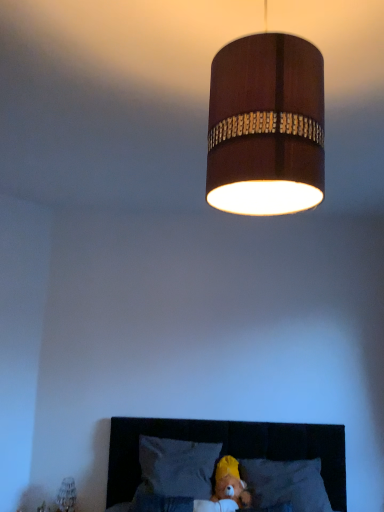
Question: Is velvet dark brown headboard at lower center aimed at wooden lampshade at upper center?

Choices:
 (A) no
 (B) yes

Answer: (A)

Question: Considering the relative sizes of velvet dark brown headboard at lower center and wooden lampshade at upper center in the image provided, is velvet dark brown headboard at lower center wider than wooden lampshade at upper center?

Choices:
 (A) yes
 (B) no

Answer: (A)

Question: Does velvet dark brown headboard at lower center contain wooden lampshade at upper center?

Choices:
 (A) yes
 (B) no

Answer: (B)

Question: From the image's perspective, is velvet dark brown headboard at lower center under wooden lampshade at upper center?

Choices:
 (A) yes
 (B) no

Answer: (A)

Question: Is velvet dark brown headboard at lower center to the right of wooden lampshade at upper center from the viewer's perspective?

Choices:
 (A) yes
 (B) no

Answer: (A)

Question: Do you think gray fabric pillow at lower center, the 2th pillow viewed from the left, is within wooden cylinder at upper center, or outside of it?

Choices:
 (A) inside
 (B) outside

Answer: (B)

Question: From the image's perspective, is gray fabric pillow at lower center, which appears as the first pillow when viewed from the right, positioned above or below wooden cylinder at upper center?

Choices:
 (A) above
 (B) below

Answer: (A)

Question: In terms of width, does gray fabric pillow at lower center, the 2th pillow viewed from the left, look wider or thinner when compared to wooden cylinder at upper center?

Choices:
 (A) thin
 (B) wide

Answer: (B)

Question: Considering the relative positions of gray fabric pillow at lower center, which appears as the first pillow when viewed from the right, and wooden cylinder at upper center in the image provided, is gray fabric pillow at lower center, which appears as the first pillow when viewed from the right, to the left or to the right of wooden cylinder at upper center?

Choices:
 (A) left
 (B) right

Answer: (B)

Question: Considering the positions of wooden lampshade at upper center and yellow plush at lower center in the image, is wooden lampshade at upper center bigger or smaller than yellow plush at lower center?

Choices:
 (A) big
 (B) small

Answer: (A)

Question: Looking at their shapes, would you say wooden lampshade at upper center is wider or thinner than yellow plush at lower center?

Choices:
 (A) thin
 (B) wide

Answer: (B)

Question: From a real-world perspective, relative to yellow plush at lower center, is wooden lampshade at upper center vertically above or below?

Choices:
 (A) below
 (B) above

Answer: (B)

Question: Relative to yellow plush at lower center, is wooden lampshade at upper center in front or behind?

Choices:
 (A) behind
 (B) front

Answer: (B)

Question: Visually, is velvet dark brown headboard at lower center positioned to the left or to the right of wooden lampshade at upper center?

Choices:
 (A) right
 (B) left

Answer: (A)

Question: Does point (261, 433) appear closer or farther from the camera than point (243, 180)?

Choices:
 (A) farther
 (B) closer

Answer: (A)